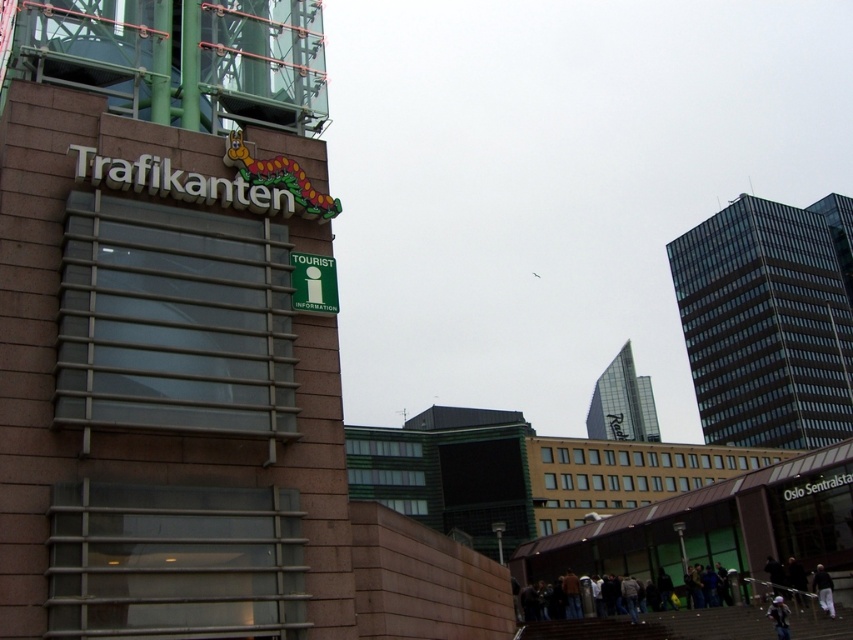
Does brown brick building at upper left have a larger size compared to glassy black skyscraper at right?

Incorrect, brown brick building at upper left is not larger than glassy black skyscraper at right.

Is point (49, 371) positioned in front of point (848, 218)?

Yes, point (49, 371) is closer to viewer.

The width and height of the screenshot is (853, 640). Identify the location of brown brick building at upper left. (166, 320).

Does brown brick building at upper left appear under white cotton shirt at lower right?

No.

Does brown brick building at upper left have a lesser width compared to white cotton shirt at lower right?

In fact, brown brick building at upper left might be wider than white cotton shirt at lower right.

Which is behind, point (294, 112) or point (811, 582)?

The point (811, 582) is behind.

At what (x,y) coordinates should I click in order to perform the action: click on brown brick building at upper left. Please return your answer as a coordinate pair (x, y). This screenshot has width=853, height=640. Looking at the image, I should click on (166, 320).

Which of these two, glassy black skyscraper at right or glassy silver tower at upper right, stands taller?

glassy black skyscraper at right is taller.

Does glassy black skyscraper at right have a lesser width compared to glassy silver tower at upper right?

Incorrect, glassy black skyscraper at right's width is not less than glassy silver tower at upper right's.

Does point (837, 339) come farther from viewer compared to point (616, 394)?

No, it is not.

Where is `glassy black skyscraper at right`? Image resolution: width=853 pixels, height=640 pixels. glassy black skyscraper at right is located at coordinates (769, 321).